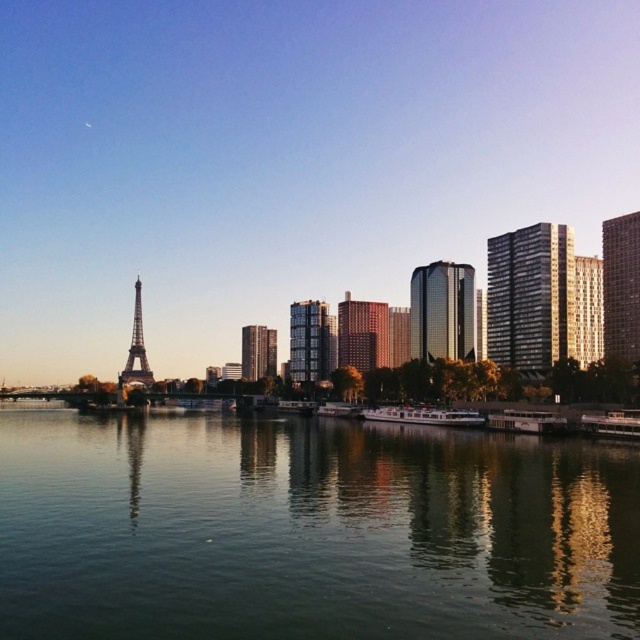
Question: Does green reflective water at center appear under glassy reflective skyscraper at center?

Choices:
 (A) yes
 (B) no

Answer: (A)

Question: Is green reflective water at center positioned in front of shiny metallic eiffel tower at left?

Choices:
 (A) yes
 (B) no

Answer: (A)

Question: Estimate the real-world distances between objects in this image. Which object is closer to the glassy reflective skyscraper at center?

Choices:
 (A) white glossy boat at lower center
 (B) dark gray glass building at right
 (C) shiny glass skyscraper at center right

Answer: (C)

Question: Based on their relative distances, which object is nearer to the shiny metallic eiffel tower at left?

Choices:
 (A) green reflective water at center
 (B) dark gray glass building at right
 (C) white glossy boat at lower center
 (D) shiny glass building at center

Answer: (D)

Question: Can you confirm if white glossy boat at center is smaller than metallic silver boat at lower right?

Choices:
 (A) no
 (B) yes

Answer: (A)

Question: Among these points, which one is farthest from the camera?

Choices:
 (A) (627, 429)
 (B) (506, 419)

Answer: (B)